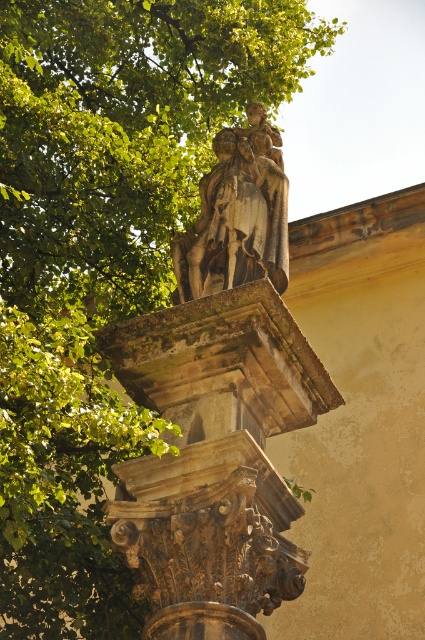
Does carved stone column at center have a lesser height compared to polished bronze statue at center?

Yes, carved stone column at center is shorter than polished bronze statue at center.

Who is more distant from viewer, (x=113, y=538) or (x=217, y=260)?

Point (x=217, y=260)

Identify the location of carved stone column at center. (215, 460).